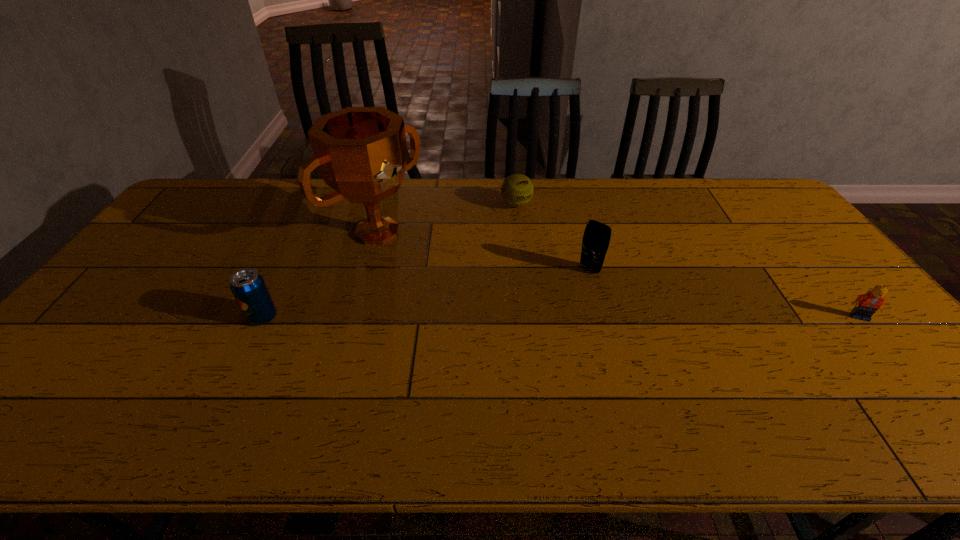
I want to click on the third tallest object, so click(247, 285).

Identify the location of pop soda. (247, 285).

Find the location of a particular element. This screenshot has width=960, height=540. Lego is located at coordinates point(866,305).

At what (x,y) coordinates should I click in order to perform the action: click on cellular telephone. Please return your answer as a coordinate pair (x, y). Looking at the image, I should click on (596, 238).

Identify the location of the fourth object from left to right. The height and width of the screenshot is (540, 960). (596, 238).

Locate an element on the screen. This screenshot has height=540, width=960. the third object from left to right is located at coordinates (517, 190).

At what (x,y) coordinates should I click in order to perform the action: click on the second object from left to right. Please return your answer as a coordinate pair (x, y). The width and height of the screenshot is (960, 540). Looking at the image, I should click on (361, 153).

I want to click on the tallest object, so click(361, 153).

I want to click on free region located 0.400m on the right of the leftmost object, so click(429, 316).

Locate an element on the screen. free space located on the front-facing side of the rightmost object is located at coordinates (900, 366).